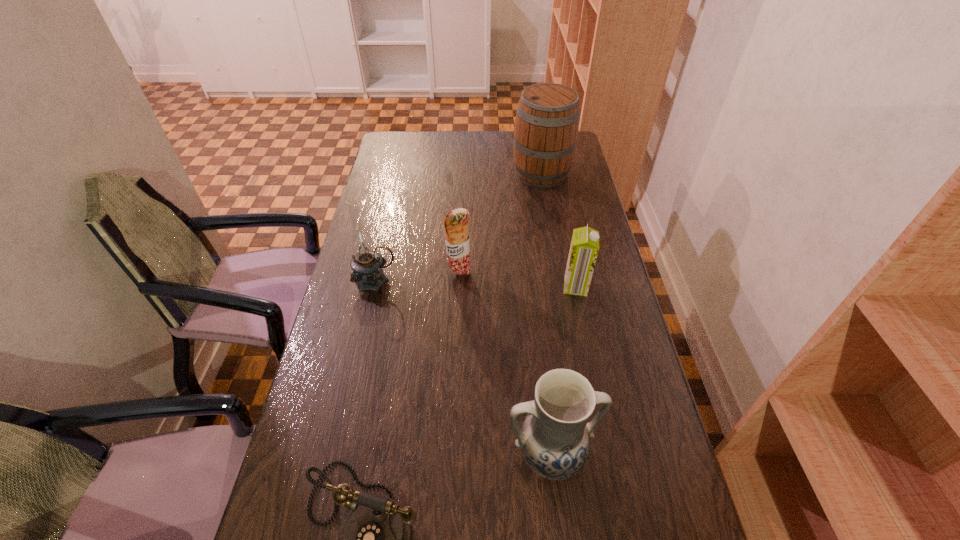
Find the location of a particular element. This screenshot has width=960, height=540. object that is the second closest to the soya milk is located at coordinates (554, 438).

Identify which object is the fourth closest to the pottery. Please provide its 2D coordinates. Your answer should be formatted as a tuple, i.e. [(x, y)], where the tuple contains the x and y coordinates of a point satisfying the conditions above.

[(367, 265)]